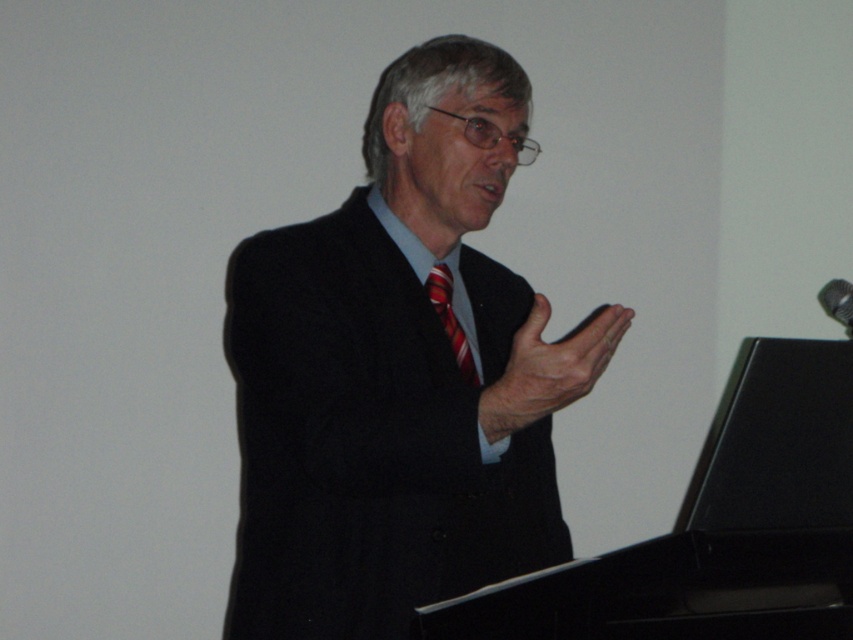
Question: Estimate the real-world distances between objects in this image. Which object is farther from the striped silk tie at center?

Choices:
 (A) black matte suit at center
 (B) metallic silver microphone at upper right

Answer: (B)

Question: Does black matte suit at center appear over metallic silver microphone at upper right?

Choices:
 (A) no
 (B) yes

Answer: (A)

Question: Is striped silk tie at center thinner than metallic silver microphone at upper right?

Choices:
 (A) no
 (B) yes

Answer: (B)

Question: Is striped silk tie at center closer to camera compared to metallic silver microphone at upper right?

Choices:
 (A) yes
 (B) no

Answer: (A)

Question: Estimate the real-world distances between objects in this image. Which object is closer to the black matte suit at center?

Choices:
 (A) striped silk tie at center
 (B) metallic silver microphone at upper right

Answer: (A)

Question: Which point appears closest to the camera in this image?

Choices:
 (A) (436, 280)
 (B) (320, 346)

Answer: (B)